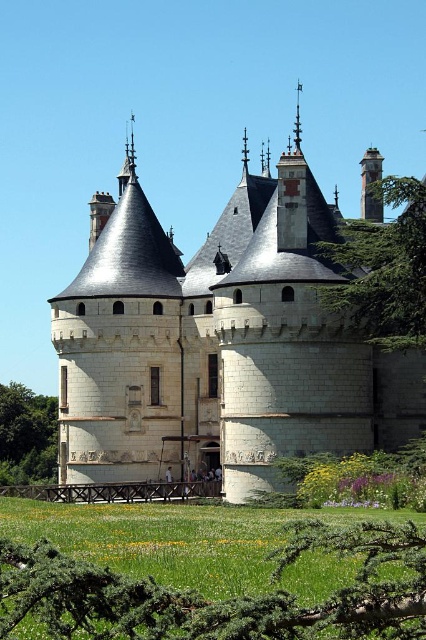
You are standing at the wooden railing on the lawn and want to walk to the castle entrance. There are two points marked on the path you need to cross. One is point (150, 445) and the other is point (187, 609). Which point should you step on first to reach the castle entrance?

You should step on point (187, 609) first because point (150, 445) is behind it, meaning point (187, 609) is closer to your starting position at the wooden railing.

Consider the image. You are a visitor standing at the entrance of the castle. You notice a green leafy tree at upper center and a dark gray stone tower at upper right. Which object is closer to you from your current position?

The green leafy tree at upper center is positioned under the dark gray stone tower at upper right, meaning the tree is closer to you than the tower.

You are standing at the point marked as point [382,269] in the image. What is the nearest object to you in the scene?

The nearest object to you is the green leafy tree at upper center because point [382,269] is located on it.